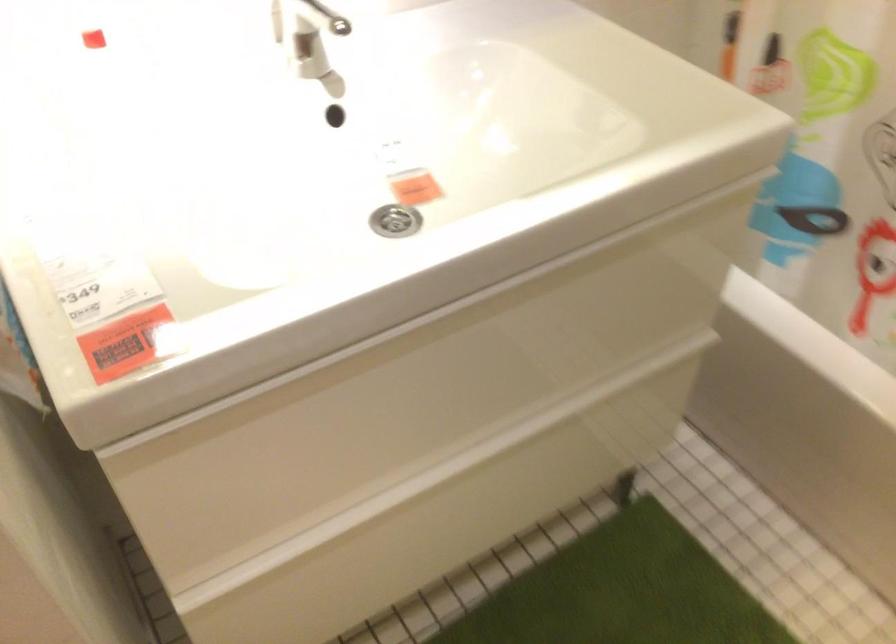
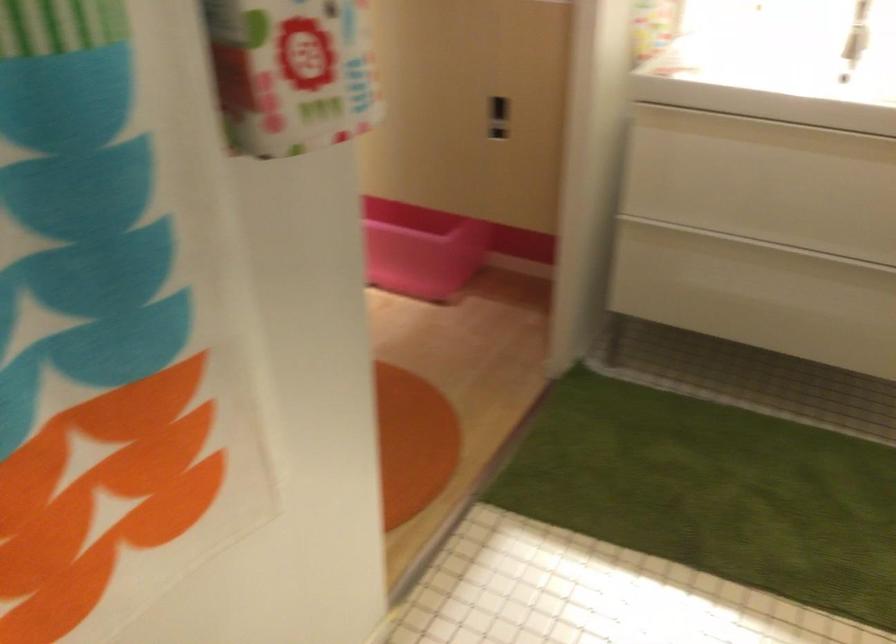
Where in the second image is the point corresponding to point 392,520 from the first image?

(734, 254)